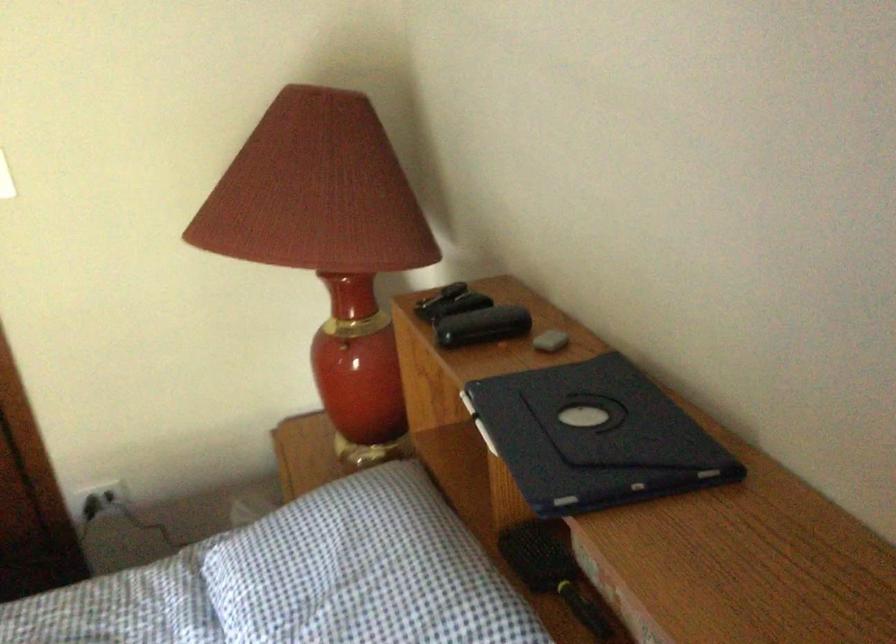
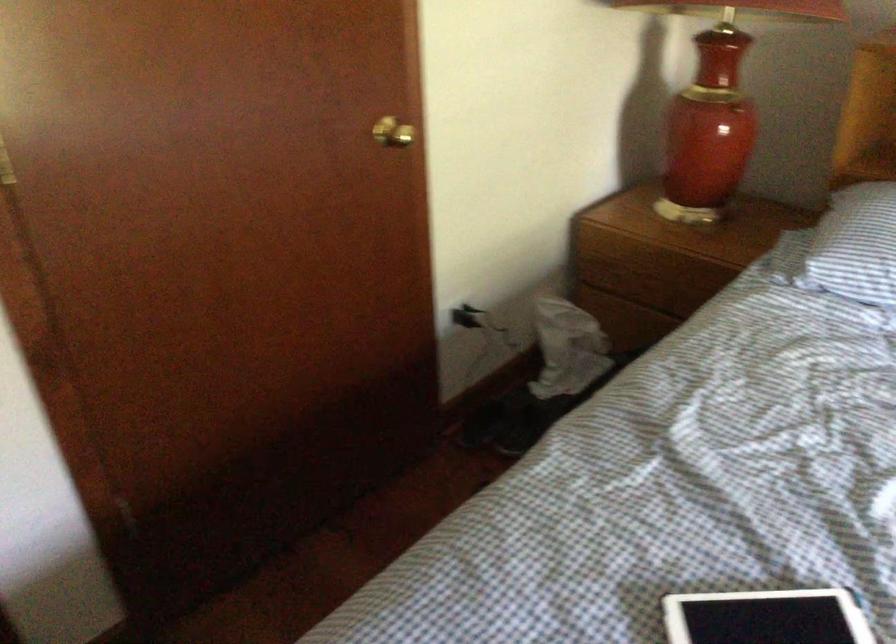
Find the pixel in the second image that matches pixel 121 496 in the first image.

(470, 317)